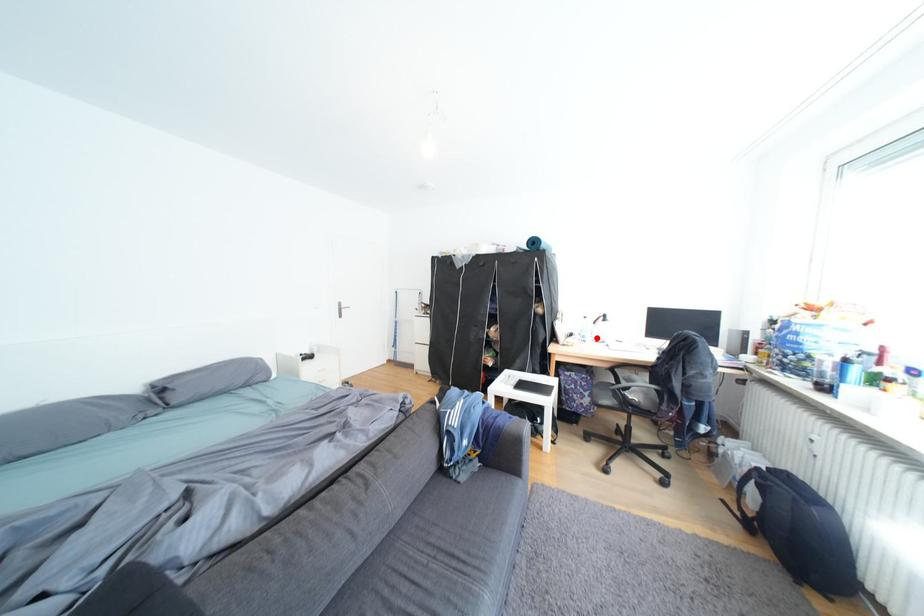
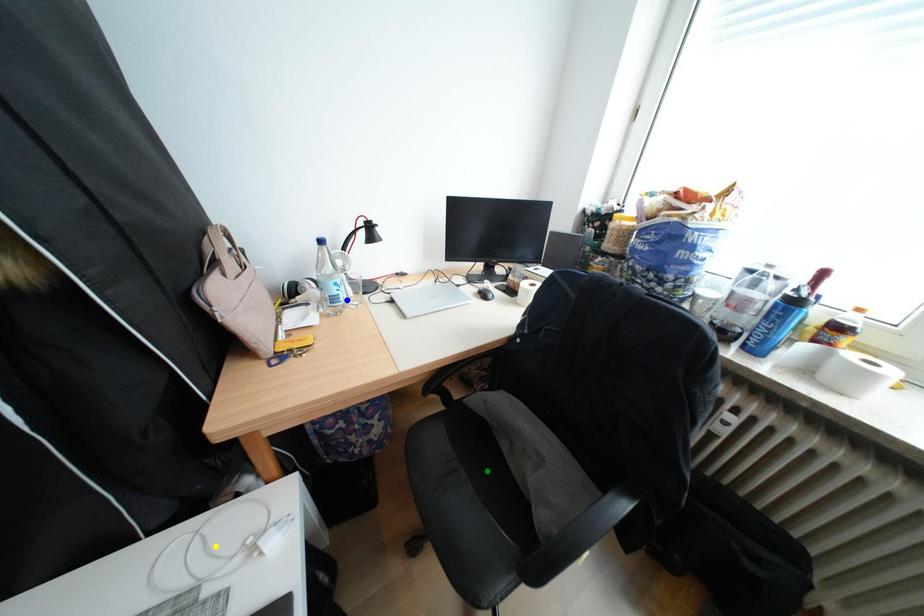
Question: I am providing you with two images of the same scene from different viewpoints. A red point is marked on the first image. You are given multiple points on the second image. Which mark in image 2 goes with the point in image 1?

Choices:
 (A) yellow point
 (B) green point
 (C) blue point

Answer: (C)